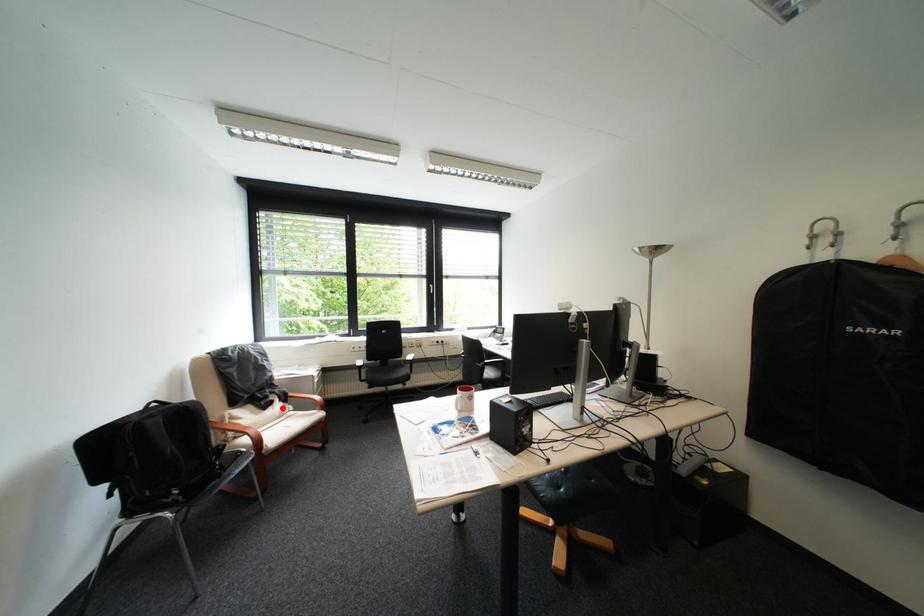
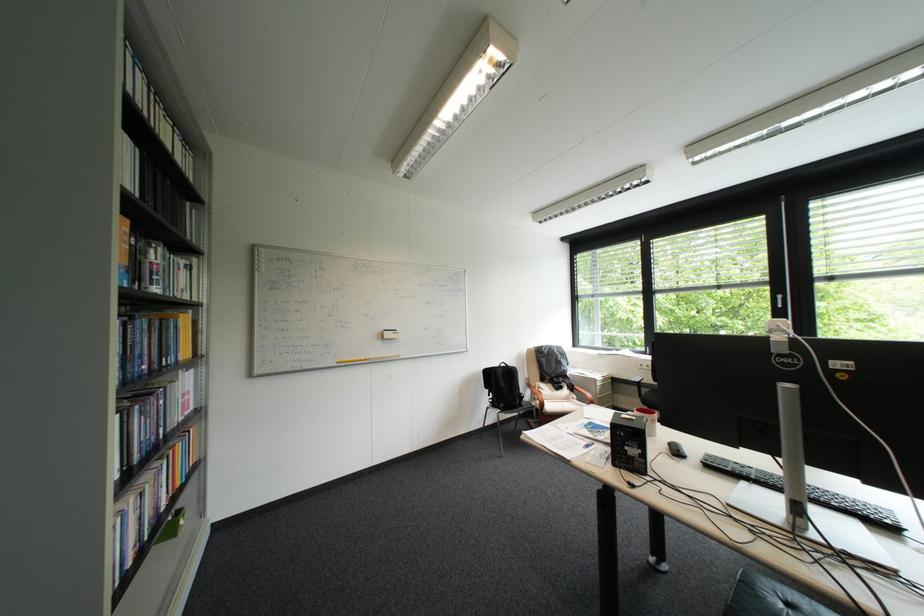
The point at the highlighted location is marked in the first image. Where is the corresponding point in the second image?

(573, 391)